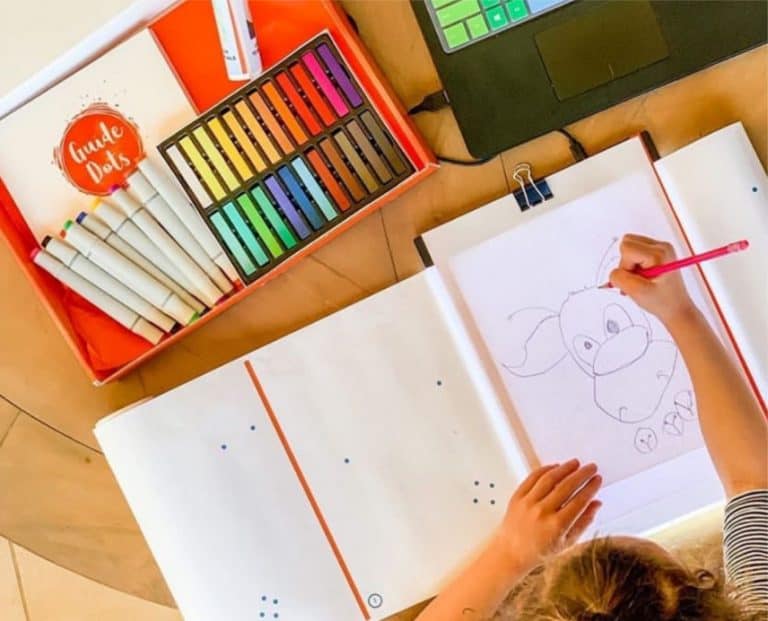
In order to click on cord in this screenshot , I will do coord(465,161).